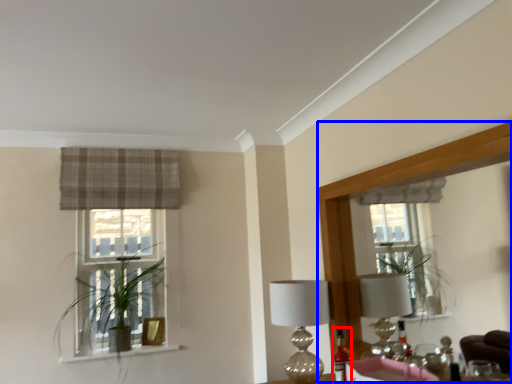
Question: Which object appears closest to the camera in this image, bottle (highlighted by a red box) or mirror (highlighted by a blue box)?

Choices:
 (A) bottle
 (B) mirror

Answer: (B)